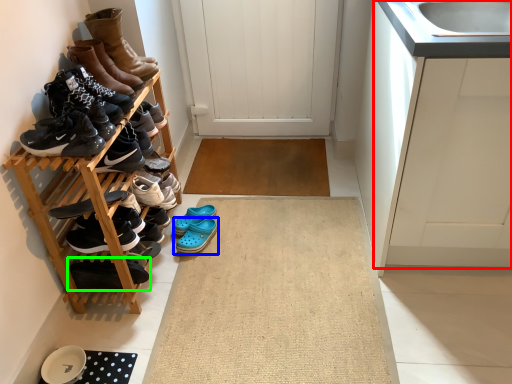
Question: Estimate the real-world distances between objects in this image. Which object is closer to cabinetry (highlighted by a red box), footwear (highlighted by a blue box) or footwear (highlighted by a green box)?

Choices:
 (A) footwear
 (B) footwear

Answer: (A)